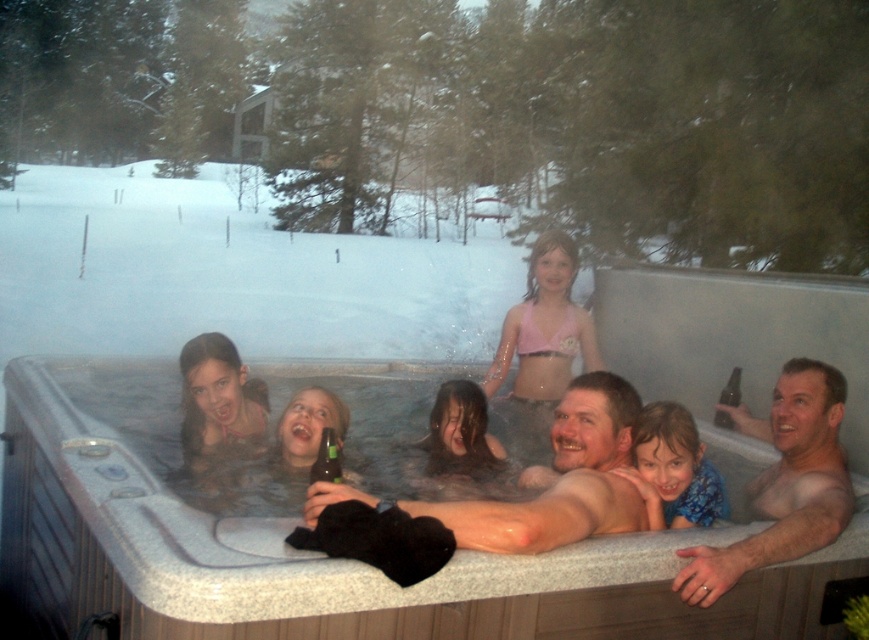
Question: Which object is positioned closest to the smooth gray hot tub at center?

Choices:
 (A) smooth skin adult at center
 (B) blue fabric at center
 (C) bare skin man at center

Answer: (A)

Question: Does smooth gray hot tub at center have a larger size compared to bare skin man at center?

Choices:
 (A) yes
 (B) no

Answer: (A)

Question: Which of these objects is positioned closest to the smooth skin adult at center?

Choices:
 (A) blue fabric at center
 (B) bare skin man at center

Answer: (A)

Question: Which object is farther from the camera taking this photo?

Choices:
 (A) smooth skin adult at center
 (B) smooth gray hot tub at center
 (C) bare skin man at center

Answer: (C)

Question: Where is smooth gray hot tub at center located in relation to smooth skin adult at center in the image?

Choices:
 (A) left
 (B) right

Answer: (A)

Question: Can you confirm if bare skin man at center is positioned above blue fabric at center?

Choices:
 (A) no
 (B) yes

Answer: (A)